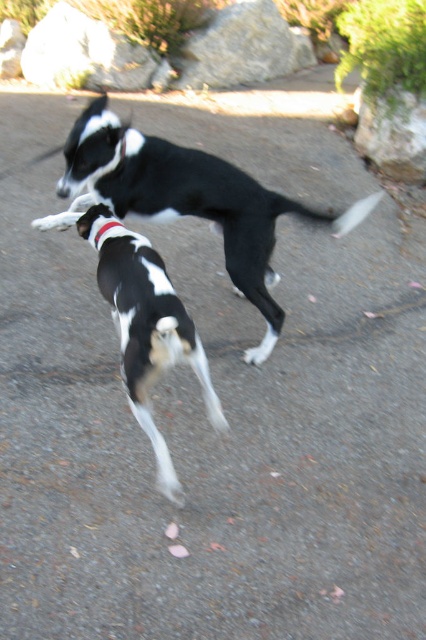
Question: Which object is positioned farthest from the red fabric neckband at center?

Choices:
 (A) black and white fur at center
 (B) black and white fur dog at center

Answer: (B)

Question: Which point is closer to the camera taking this photo?

Choices:
 (A) (111, 128)
 (B) (158, 365)

Answer: (B)

Question: Can you confirm if black and white fur dog at center is wider than red fabric neckband at center?

Choices:
 (A) yes
 (B) no

Answer: (A)

Question: Can you confirm if black and white fur dog at center is wider than black and white fur at center?

Choices:
 (A) yes
 (B) no

Answer: (A)

Question: Among these points, which one is nearest to the camera?

Choices:
 (A) (114, 227)
 (B) (175, 324)
 (C) (244, 244)

Answer: (B)

Question: Is black and white fur dog at center behind black and white fur at center?

Choices:
 (A) no
 (B) yes

Answer: (B)